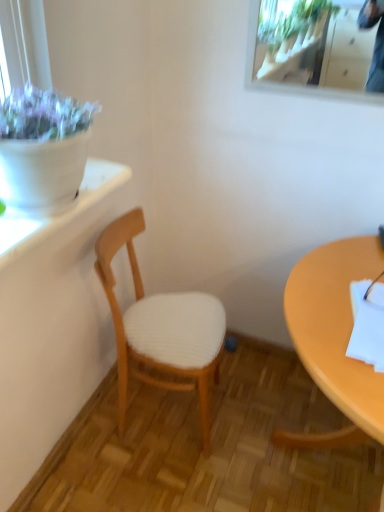
What are the coordinates of `vacant space in wooden chair at center (from a real-world perspective)` in the screenshot? It's located at (163, 412).